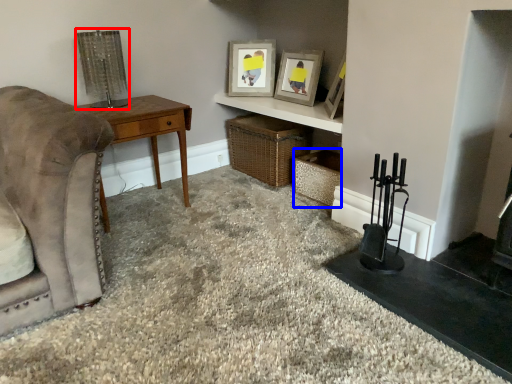
Question: Which of the following is the closest to the observer, lamp (highlighted by a red box) or crate (highlighted by a blue box)?

Choices:
 (A) lamp
 (B) crate

Answer: (A)